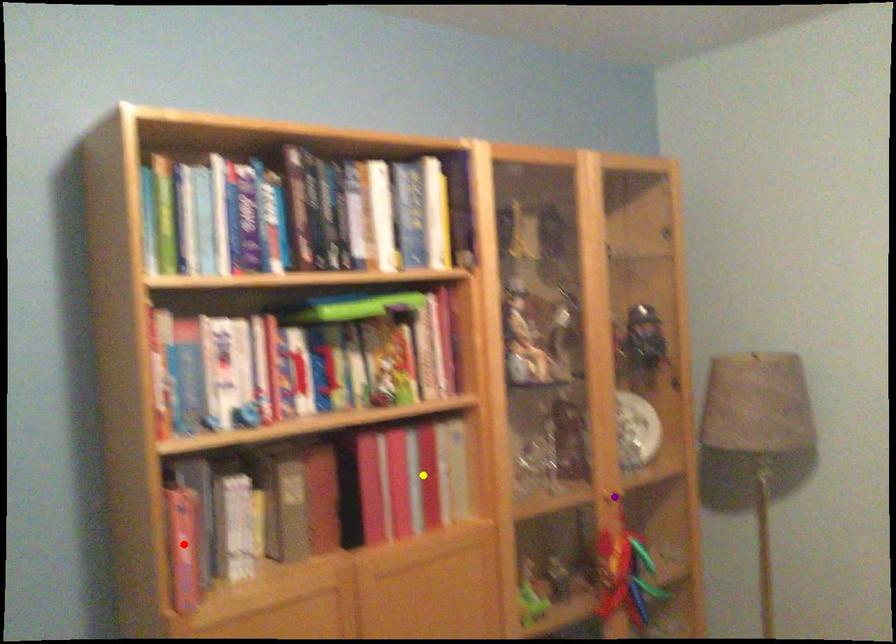
Order these from nearest to farthest:
1. red point
2. purple point
3. yellow point

purple point → yellow point → red point